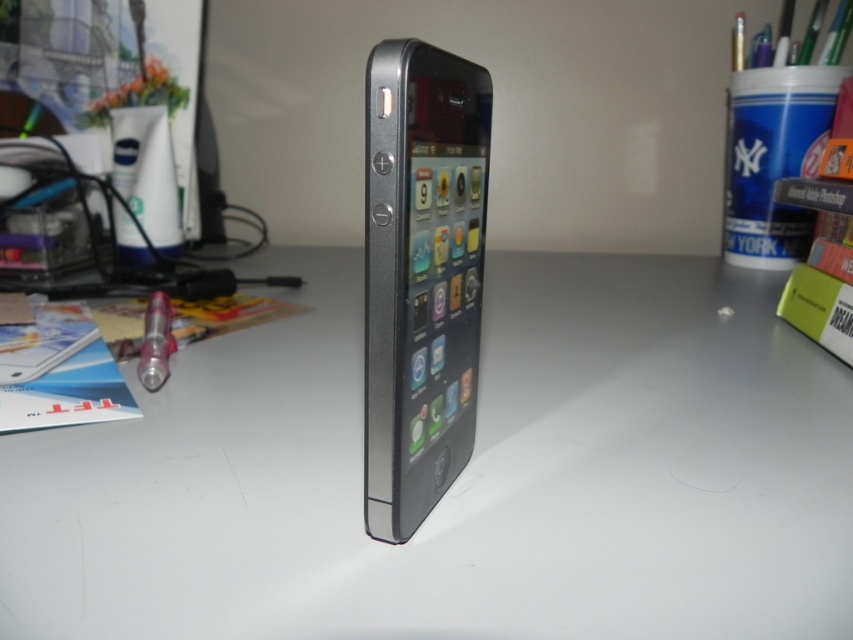
You are organizing your desk and want to place a new item between the matte white lotion at left and the metallic pen at left. Given the space between them is 23.26 inches, can you fit an item that is 24 inches long?

The distance between the matte white lotion at left and the metallic pen at left is 23.26 inches, so an item that is 24 inches long cannot fit in the space between them.

You are organizing your desk and want to place a metallic pen at left on top of the white matte table at center. Is this possible based on their current positions?

The white matte table at center is located above the metallic pen at left, so yes, you can place the metallic pen at left on top of the white matte table at center since it is already positioned below it.